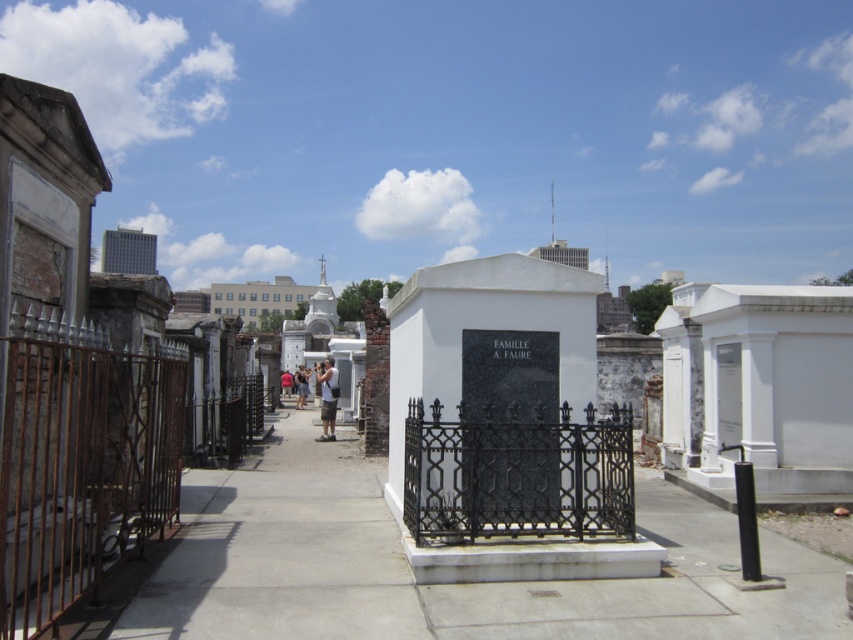
You are a visitor at the cemetery and want to walk from the rusty iron fence at left to the camouflage shorts at center. Which path is wider? Please choose between the two options.

The path between the rusty iron fence at left and the camouflage shorts at center is wider than the rusty iron fence at left because the rusty iron fence at left is thinner than camouflage shorts at center.

Consider the image. You are a photographer standing in the cemetery scene. You notice a person wearing camouflage shorts at center and a red shirt at center. Which piece of clothing is higher on the person?

The camouflage shorts at center is above the red shirt at center, so the camouflage shorts at center is higher on the person.